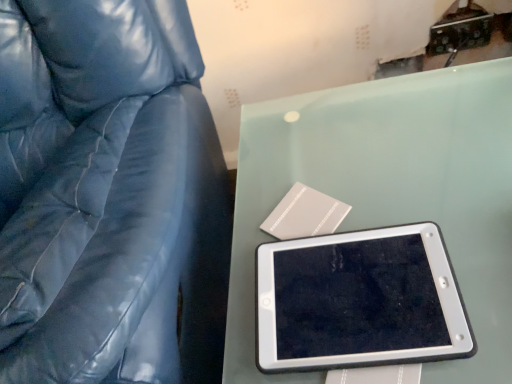
Measure the distance between point (327,253) and camera.

A distance of 1.10 meters exists between point (327,253) and camera.

What are the coordinates of `black plastic tablet at center` in the screenshot? It's located at (359, 301).

The width and height of the screenshot is (512, 384). Describe the element at coordinates (359, 301) in the screenshot. I see `black plastic tablet at center` at that location.

Find the location of a particular element. The image size is (512, 384). matte blue leather chair at left is located at coordinates (108, 196).

Image resolution: width=512 pixels, height=384 pixels. Describe the element at coordinates (108, 196) in the screenshot. I see `matte blue leather chair at left` at that location.

Image resolution: width=512 pixels, height=384 pixels. I want to click on black plastic tablet at center, so click(359, 301).

In the image, is matte blue leather chair at left on the left side or the right side of black plastic tablet at center?

matte blue leather chair at left is positioned on black plastic tablet at center's left side.

Is matte blue leather chair at left in front of or behind black plastic tablet at center in the image?

Visually, matte blue leather chair at left is located in front of black plastic tablet at center.

Does point (136, 110) come in front of point (265, 327)?

No, it is not.

From the image's perspective, does matte blue leather chair at left appear lower than black plastic tablet at center?

No, from the image's perspective, matte blue leather chair at left is not beneath black plastic tablet at center.

From a real-world perspective, is matte blue leather chair at left physically below black plastic tablet at center?

Yes, from a real-world perspective, matte blue leather chair at left is beneath black plastic tablet at center.

Consider the image. Between matte blue leather chair at left and black plastic tablet at center, which one has larger width?

matte blue leather chair at left.

Considering the relative sizes of matte blue leather chair at left and black plastic tablet at center in the image provided, is matte blue leather chair at left taller than black plastic tablet at center?

Yes.

Does matte blue leather chair at left have a larger size compared to black plastic tablet at center?

Yes, matte blue leather chair at left is bigger than black plastic tablet at center.

From the picture: Would you say matte blue leather chair at left is outside black plastic tablet at center?

matte blue leather chair at left lies outside black plastic tablet at center's area.

Is matte blue leather chair at left positioned far away from black plastic tablet at center?

No.

Is matte blue leather chair at left oriented away from black plastic tablet at center?

matte blue leather chair at left does not have its back to black plastic tablet at center.

Measure the distance from matte blue leather chair at left to black plastic tablet at center.

matte blue leather chair at left and black plastic tablet at center are 13.98 inches apart.

The height and width of the screenshot is (384, 512). What are the coordinates of `furniture in front of the black plastic tablet at center` in the screenshot? It's located at (108, 196).

Based on the photo, which is more to the right, black plastic tablet at center or matte blue leather chair at left?

black plastic tablet at center.

Which object is further away from the camera, black plastic tablet at center or matte blue leather chair at left?

black plastic tablet at center is further from the camera.

Does point (402, 349) appear closer or farther from the camera than point (37, 97)?

Point (402, 349) appears to be closer to the viewer than point (37, 97).

From the image's perspective, would you say black plastic tablet at center is shown under matte blue leather chair at left?

Correct, black plastic tablet at center appears lower than matte blue leather chair at left in the image.

From a real-world perspective, is black plastic tablet at center under matte blue leather chair at left?

Incorrect, from a real-world perspective, black plastic tablet at center is higher than matte blue leather chair at left.

Is black plastic tablet at center wider or thinner than matte blue leather chair at left?

In the image, black plastic tablet at center appears to be more narrow than matte blue leather chair at left.

Is black plastic tablet at center taller than matte blue leather chair at left?

In fact, black plastic tablet at center may be shorter than matte blue leather chair at left.

Considering the sizes of objects black plastic tablet at center and matte blue leather chair at left in the image provided, who is smaller, black plastic tablet at center or matte blue leather chair at left?

Smaller between the two is black plastic tablet at center.

Is black plastic tablet at center not inside matte blue leather chair at left?

Yes, black plastic tablet at center is located beyond the bounds of matte blue leather chair at left.

Is black plastic tablet at center next to matte blue leather chair at left and touching it?

No, black plastic tablet at center is not making contact with matte blue leather chair at left.

Is black plastic tablet at center oriented away from matte blue leather chair at left?

No, matte blue leather chair at left is not at the back of black plastic tablet at center.

Based on the photo, can you tell me how much black plastic tablet at center and matte blue leather chair at left differ in facing direction?

89.3 degrees separate the facing orientations of black plastic tablet at center and matte blue leather chair at left.

Measure the distance from black plastic tablet at center to matte blue leather chair at left.

black plastic tablet at center is 35.52 centimeters from matte blue leather chair at left.

Locate an element on the screen. This screenshot has width=512, height=384. furniture in front of the black plastic tablet at center is located at coordinates (108, 196).

You are a GUI agent. You are given a task and a screenshot of the screen. Output one action in this format:
    pyautogui.click(x=<x>, y=<y>)
    Task: Click on the furniture that is on the left side of black plastic tablet at center
    The image size is (512, 384).
    Given the screenshot: What is the action you would take?
    pyautogui.click(x=108, y=196)

Where is `tablet computer on the right of the matte blue leather chair at left`? Image resolution: width=512 pixels, height=384 pixels. tablet computer on the right of the matte blue leather chair at left is located at coordinates tap(359, 301).